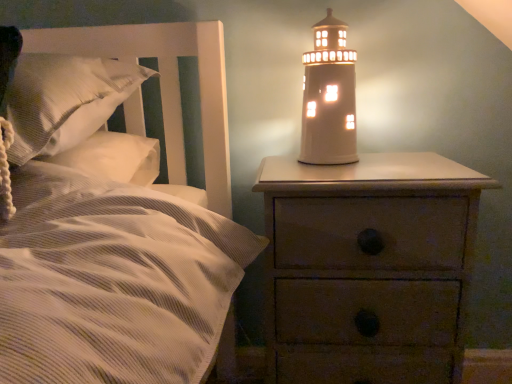
Question: In the image, is wooden nightstand at right positioned in front of or behind white ceramic lighthouse at upper right?

Choices:
 (A) front
 (B) behind

Answer: (A)

Question: From the image's perspective, is wooden nightstand at right located above or below white ceramic lighthouse at upper right?

Choices:
 (A) below
 (B) above

Answer: (A)

Question: Estimate the real-world distances between objects in this image. Which object is closer to the white ceramic lighthouse at upper right?

Choices:
 (A) white textured pillow at left
 (B) wooden nightstand at right

Answer: (B)

Question: Which object is positioned closest to the white ceramic lighthouse at upper right?

Choices:
 (A) wooden nightstand at right
 (B) white textured pillow at left

Answer: (A)